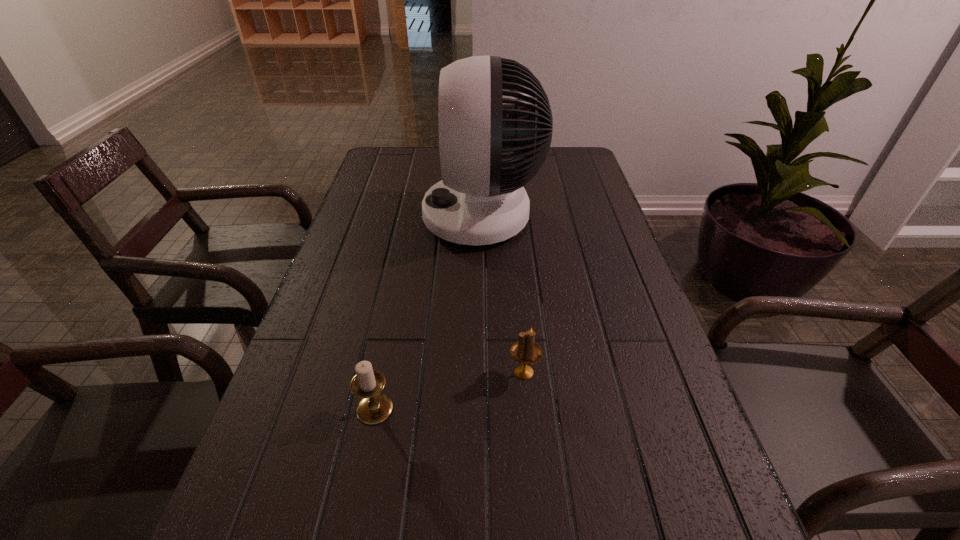
Where is `free area in between the farthest object and the nearest object`? This screenshot has width=960, height=540. free area in between the farthest object and the nearest object is located at coordinates (428, 313).

Find the location of a particular element. Image resolution: width=960 pixels, height=540 pixels. object that stands as the second closest to the farthest object is located at coordinates (374, 407).

Find the location of a particular element. The width and height of the screenshot is (960, 540). object that is the closest to the second nearest object is located at coordinates coord(374,407).

Select which candle holder is the second closest to the tallest object. Please provide its 2D coordinates. Your answer should be formatted as a tuple, i.e. [(x, y)], where the tuple contains the x and y coordinates of a point satisfying the conditions above.

[(374, 407)]

Locate an element on the screen. This screenshot has width=960, height=540. free spot that satisfies the following two spatial constraints: 1. on the back side of the farther candle holder; 2. on the grille of the fan is located at coordinates (510, 217).

This screenshot has width=960, height=540. In order to click on free spot that satisfies the following two spatial constraints: 1. on the back side of the farther candle holder; 2. on the grille of the fan in this screenshot , I will do `click(510, 217)`.